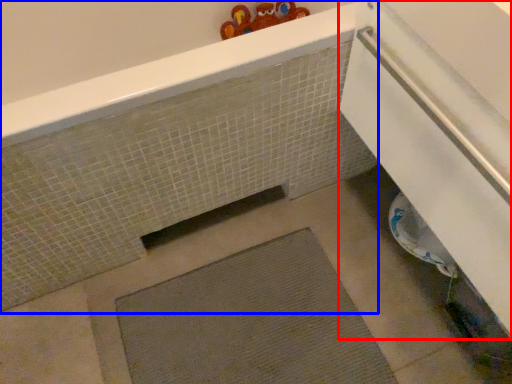
Question: Which object is closer to the camera taking this photo, screen door (highlighted by a red box) or bath (highlighted by a blue box)?

Choices:
 (A) screen door
 (B) bath

Answer: (A)